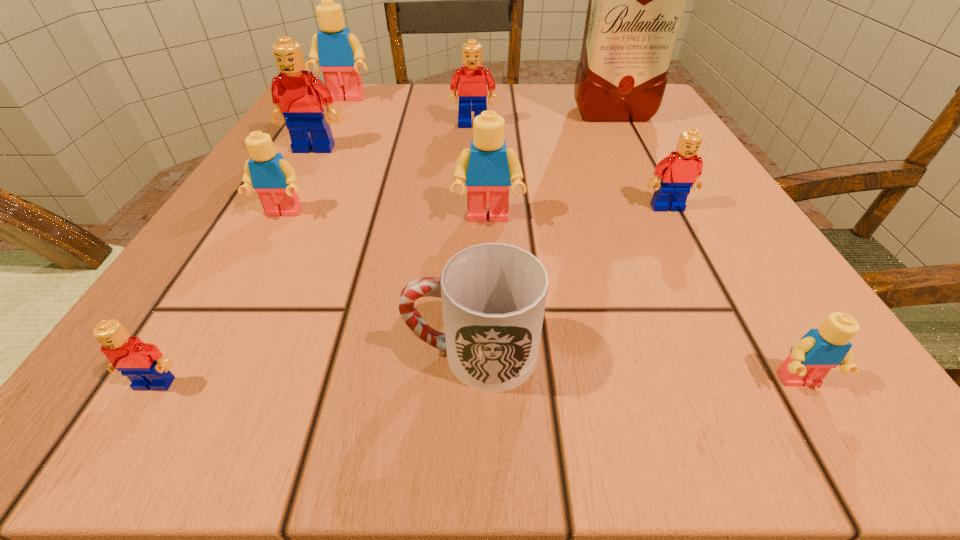
Identify the location of free space between the seventh nearest object and the tallest object. The height and width of the screenshot is (540, 960). (464, 131).

Find the location of a particular element. free space between the third yellow Lego from left to right and the tallest object is located at coordinates (550, 166).

This screenshot has width=960, height=540. Find the location of `free area in between the third biggest yellow Lego and the sixth nearest Lego`. free area in between the third biggest yellow Lego and the sixth nearest Lego is located at coordinates (299, 181).

In order to click on vacant area that lies between the second biggest red Lego and the smallest red Lego in this screenshot , I will do `click(314, 254)`.

Locate which object ranks second in proximity to the third biggest yellow Lego. Please provide its 2D coordinates. Your answer should be formatted as a tuple, i.e. [(x, y)], where the tuple contains the x and y coordinates of a point satisfying the conditions above.

[(488, 168)]

Identify which object is the fifth closest to the nearest red Lego. Please provide its 2D coordinates. Your answer should be formatted as a tuple, i.e. [(x, y)], where the tuple contains the x and y coordinates of a point satisfying the conditions above.

[(819, 350)]

You are a GUI agent. You are given a task and a screenshot of the screen. Output one action in this format:
    pyautogui.click(x=<x>, y=<y>)
    Task: Click on the Lego identified as the sixth closest to the second biggest red Lego
    This screenshot has height=540, width=960.
    Given the screenshot: What is the action you would take?
    pyautogui.click(x=143, y=363)

Identify which Lego is the second nearest to the sixth nearest Lego. Please provide its 2D coordinates. Your answer should be formatted as a tuple, i.e. [(x, y)], where the tuple contains the x and y coordinates of a point satisfying the conditions above.

[(339, 53)]

Image resolution: width=960 pixels, height=540 pixels. I want to click on yellow Lego that stands as the fourth closest to the tallest object, so click(819, 350).

Identify which yellow Lego is the nearest to the seventh nearest object. Please provide its 2D coordinates. Your answer should be formatted as a tuple, i.e. [(x, y)], where the tuple contains the x and y coordinates of a point satisfying the conditions above.

[(274, 179)]